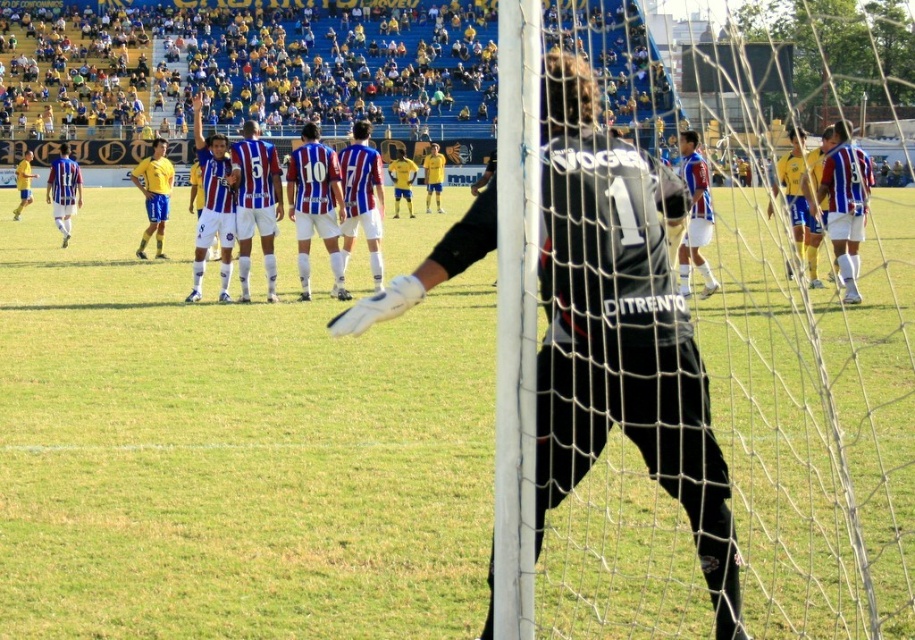
You are a soccer referee observing the match. You notice two players wearing the blue striped jersey at center and the blue and white striped jersey at left. Which player is closer to the ground?

Result: The blue striped jersey at center is located below the blue and white striped jersey at left, so the player wearing the blue striped jersey at center is closer to the ground.

You are a soccer player positioned at the goalkeeper near the goalpost. You want to kick the ball to the green grass at center located at point (x=232, y=449). Is the ball currently on the green grass at center?

The green grass at center is located at point (x=232, y=449), so if the ball is there, it would be on the green grass at center. However, the current position of the ball isn

You are a drone operator flying a drone above the soccer field. You need to capture two specific points marked as point (677,252) and point (81,195). Which point will appear larger in your camera frame?

Point (677,252) is closer to the camera than point (81,195), so it will appear larger in the camera frame.